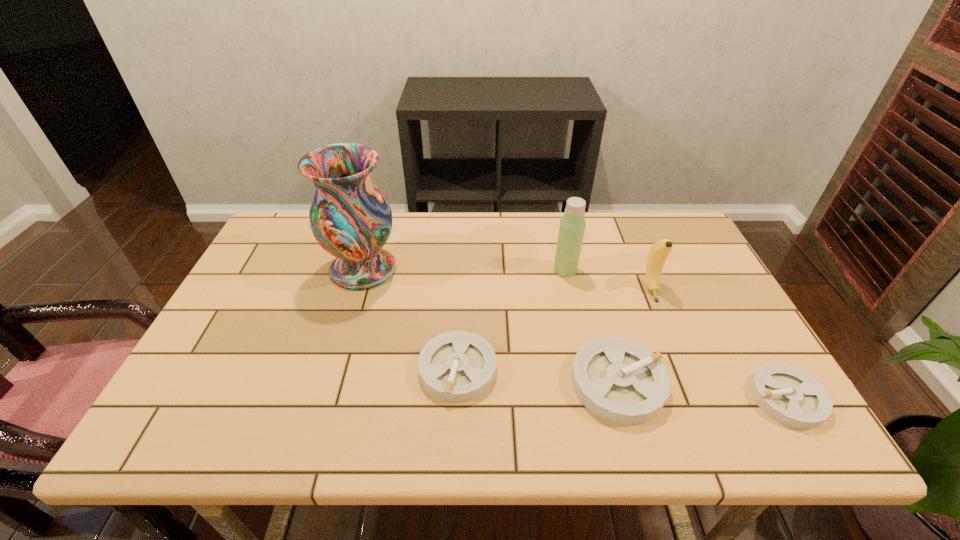
Given the evenly spaced ashtrays in the image, where should an extra ashtray be added on the left to preserve the spacing? Please point to a vacant space. Please provide its 2D coordinates. Your answer should be formatted as a tuple, i.e. [(x, y)], where the tuple contains the x and y coordinates of a point satisfying the conditions above.

[(306, 356)]